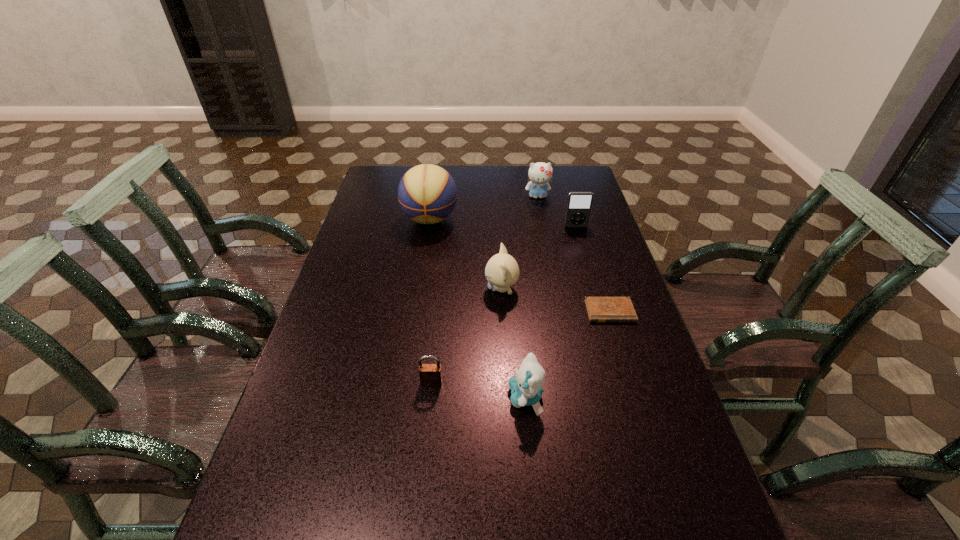
Find the location of a particular element. The width and height of the screenshot is (960, 540). free space located on the front-facing side of the iPod is located at coordinates (589, 273).

The width and height of the screenshot is (960, 540). I want to click on free spot located 0.240m on the face of the second nearest kitten, so click(x=405, y=289).

Where is `vacant space located on the face of the second nearest kitten`? This screenshot has width=960, height=540. vacant space located on the face of the second nearest kitten is located at coordinates (421, 289).

Where is `free region located 0.280m on the face of the second nearest kitten`? free region located 0.280m on the face of the second nearest kitten is located at coordinates (392, 289).

This screenshot has height=540, width=960. Find the location of `free space located 0.100m on the face of the nearest kitten`. free space located 0.100m on the face of the nearest kitten is located at coordinates (466, 397).

Locate an element on the screen. Image resolution: width=960 pixels, height=540 pixels. free space located 0.340m on the face of the nearest kitten is located at coordinates (364, 397).

Locate an element on the screen. The width and height of the screenshot is (960, 540). vacant area situated 0.300m on the face of the nearest kitten is located at coordinates (381, 397).

This screenshot has height=540, width=960. I want to click on free spot located on the front-facing side of the padlock, so click(x=427, y=424).

Image resolution: width=960 pixels, height=540 pixels. I want to click on free space located 0.120m on the spine side of the shortest object, so (x=624, y=357).

Locate an element on the screen. object that is at the far edge is located at coordinates (540, 173).